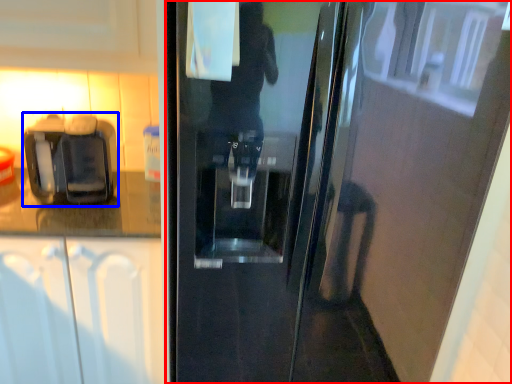
Question: Among these objects, which one is nearest to the camera, door (highlighted by a red box) or coffee machine (highlighted by a blue box)?

Choices:
 (A) door
 (B) coffee machine

Answer: (A)